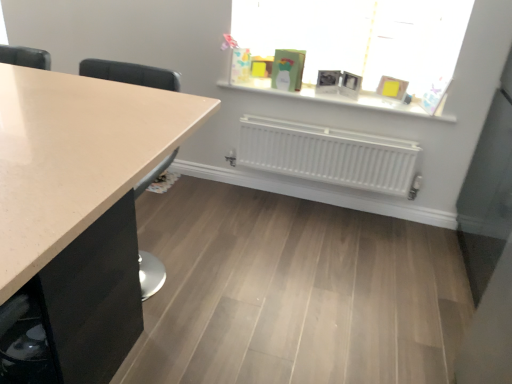
Locate an element on the screen. This screenshot has width=512, height=384. free space to the right of matte beige countertop at left is located at coordinates (214, 275).